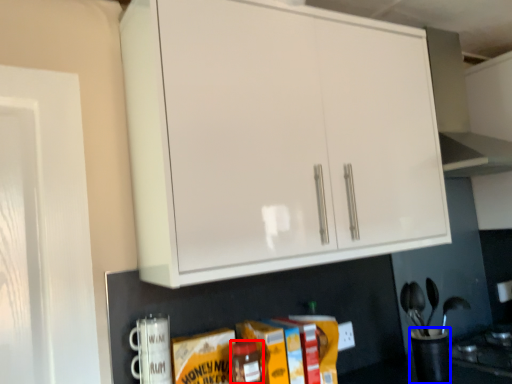
Question: Which object is closer to the camera taking this photo, bottle (highlighted by a red box) or appliance (highlighted by a blue box)?

Choices:
 (A) bottle
 (B) appliance

Answer: (A)